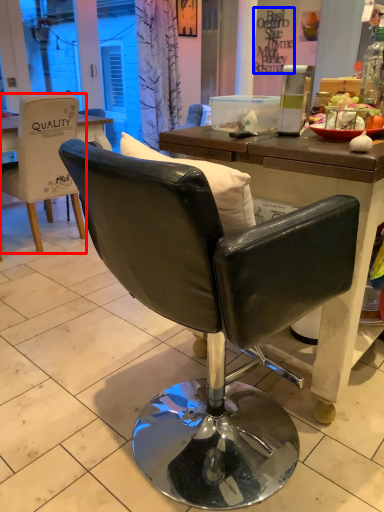
Question: Which object is further to the camera taking this photo, chair (highlighted by a red box) or writing (highlighted by a blue box)?

Choices:
 (A) chair
 (B) writing

Answer: (B)